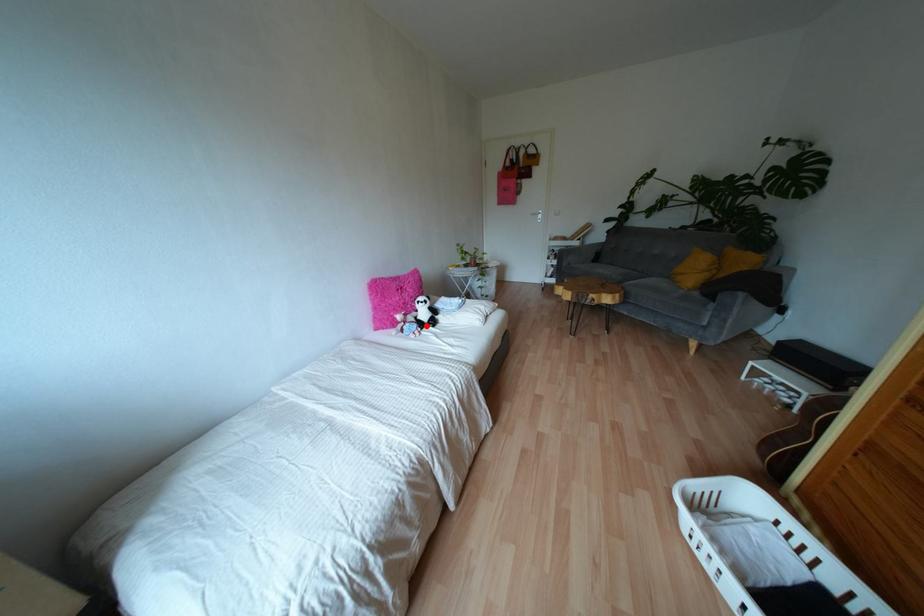
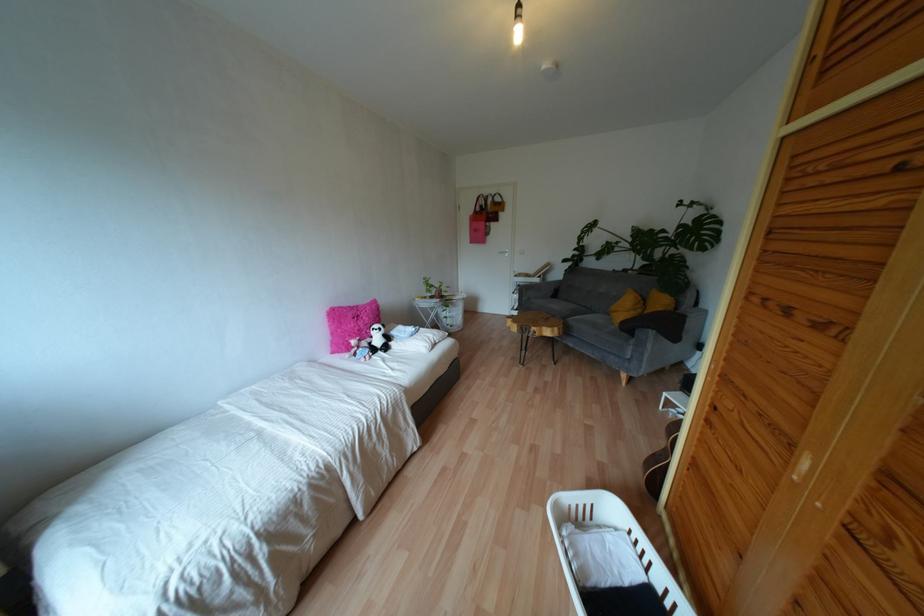
The point at the highlighted location is marked in the first image. Where is the corresponding point in the second image?

(379, 352)